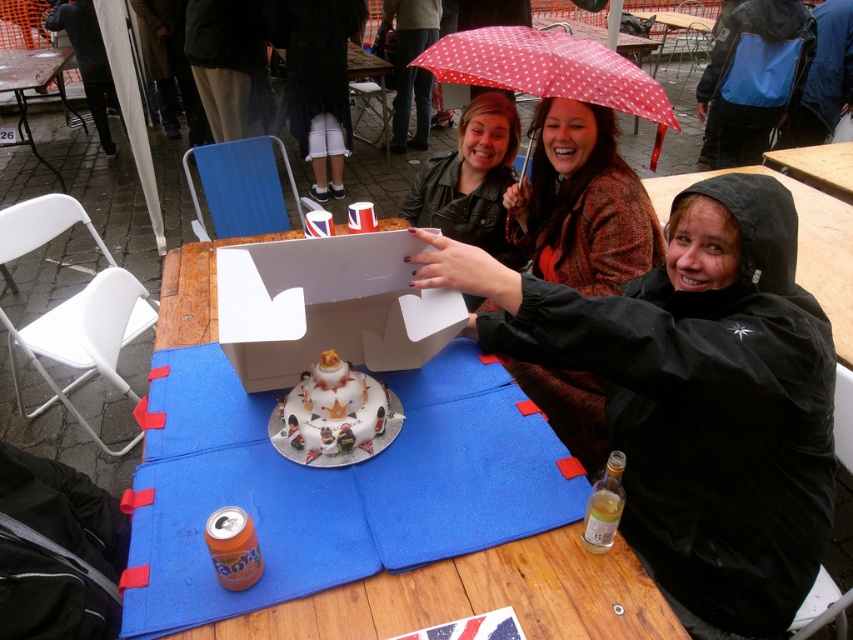
You are standing in the outdoor scene and want to reach the point marked as point (497, 67). If your walking speed is 3 feet per second, how many seconds will it take you to reach that point?

The point (497, 67) is 6.65 feet away from the viewer. At a walking speed of 3 feet per second, it will take approximately 2.22 seconds to reach the point.